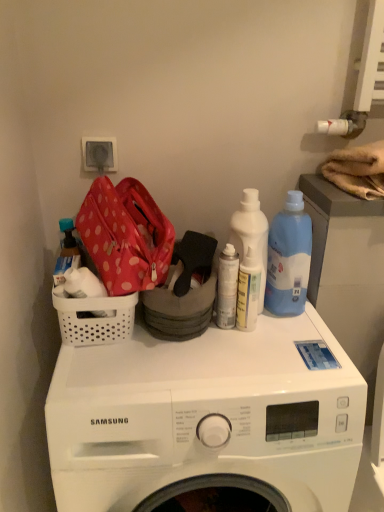
What are the coordinates of `vacant area that lies in front of white plastic bottle at center, acting as the 2th cleaning product starting from the right` in the screenshot? It's located at (260, 351).